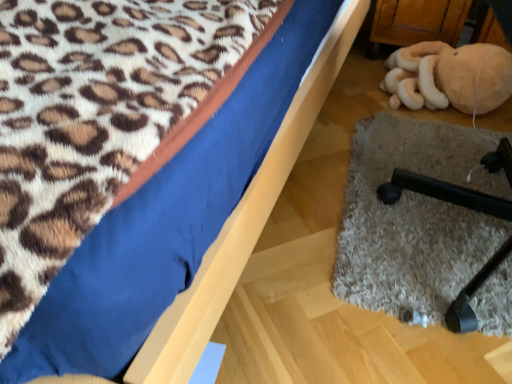
The image size is (512, 384). What are the coordinates of `vacant space positioned to the left of beige plush toy at lower right` in the screenshot? It's located at 352,100.